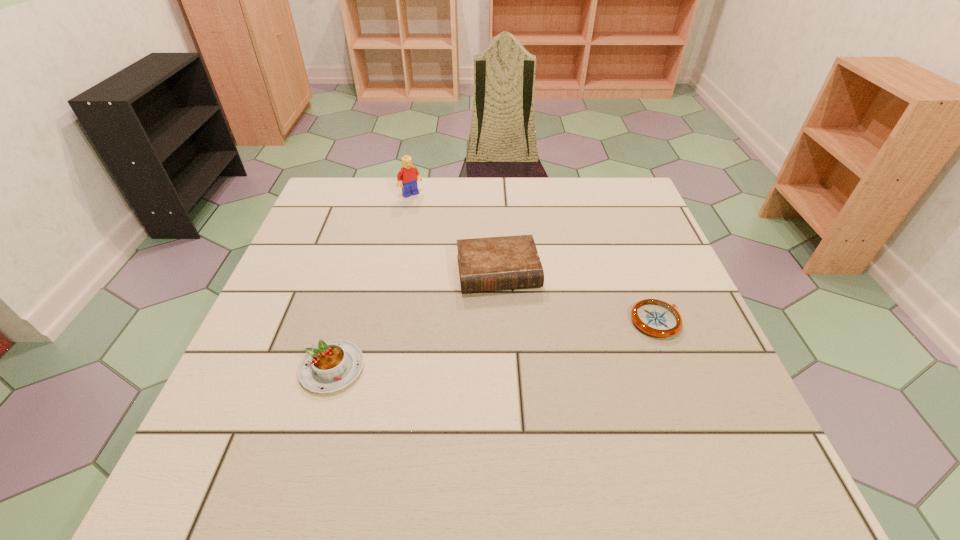
What are the coordinates of `free space between the farthest object and the second farthest object` in the screenshot? It's located at (454, 233).

The width and height of the screenshot is (960, 540). What are the coordinates of `vacant area that lies between the pudding and the farthest object` in the screenshot? It's located at (372, 281).

At what (x,y) coordinates should I click in order to perform the action: click on free space between the Lego and the second object from right to left. Please return your answer as a coordinate pair (x, y). Looking at the image, I should click on (454, 233).

This screenshot has width=960, height=540. Identify the location of the third closest object relative to the rightmost object. (408, 175).

Find the location of a particular element. The width and height of the screenshot is (960, 540). object that is the third closest to the diary is located at coordinates (408, 175).

Image resolution: width=960 pixels, height=540 pixels. I want to click on vacant space that satisfies the following two spatial constraints: 1. on the back side of the Lego; 2. on the right side of the pudding, so click(x=383, y=194).

The width and height of the screenshot is (960, 540). In order to click on vacant region that satisfies the following two spatial constraints: 1. on the front side of the second nearest object; 2. on the left side of the third object from left to right in this screenshot , I will do `click(500, 321)`.

Locate an element on the screen. This screenshot has height=540, width=960. free space that satisfies the following two spatial constraints: 1. on the front side of the Lego; 2. on the right side of the second farthest object is located at coordinates (395, 272).

Where is `blank area in the image that satisfies the following two spatial constraints: 1. on the front side of the farthest object; 2. on the left side of the second farthest object`? This screenshot has height=540, width=960. blank area in the image that satisfies the following two spatial constraints: 1. on the front side of the farthest object; 2. on the left side of the second farthest object is located at coordinates (395, 272).